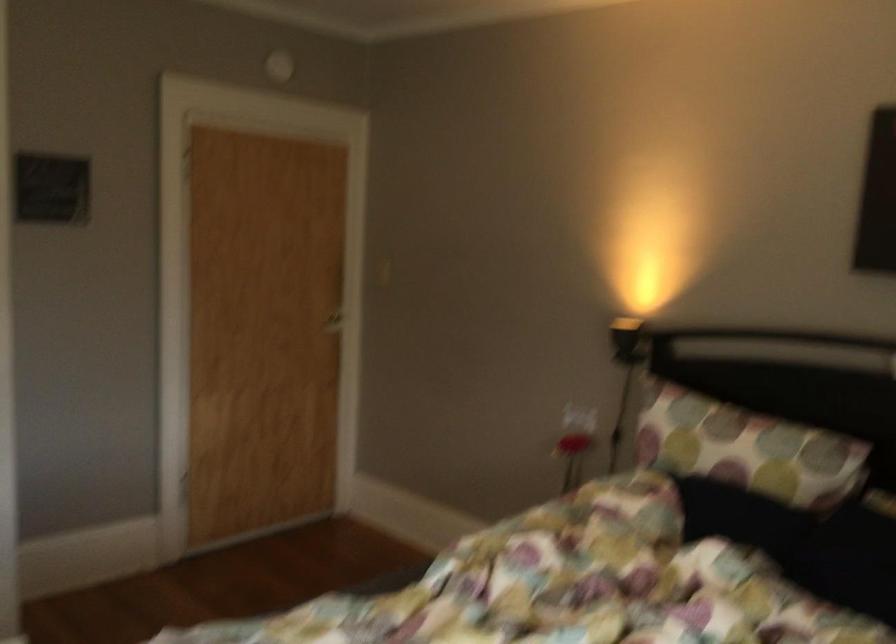
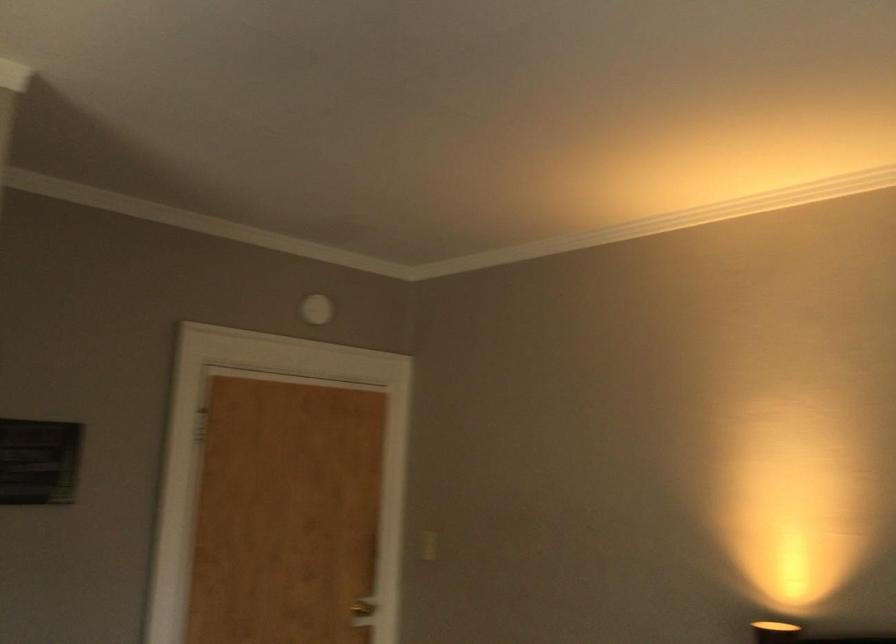
The point at (333, 319) is marked in the first image. Where is the corresponding point in the second image?

(362, 612)